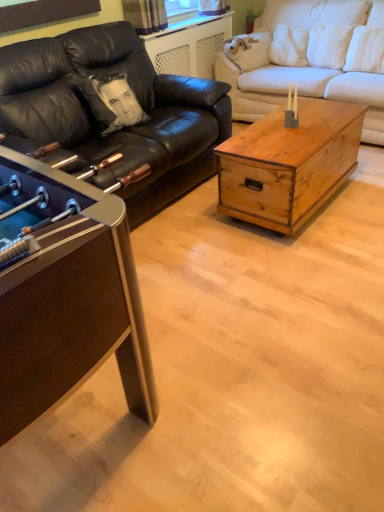
What do you see at coordinates (99, 122) in the screenshot?
I see `black leather couch at left, positioned as the first studio couch in left-to-right order` at bounding box center [99, 122].

What do you see at coordinates (311, 59) in the screenshot?
I see `white fabric couch at center, which is counted as the 1th studio couch, starting from the right` at bounding box center [311, 59].

In order to face white fabric couch at center, the 2th studio couch from the left, should I rotate leftwards or rightwards?

To align with it, rotate right about 16.221°.

Locate an element on the screen. The height and width of the screenshot is (512, 384). rustic wood trunk at center, positioned as the second coffee table in left-to-right order is located at coordinates (288, 164).

How much space does metallic brown foosball table at left, the second coffee table positioned from the right, occupy vertically?

metallic brown foosball table at left, the second coffee table positioned from the right, is 36.22 inches in height.

Where is `black leather couch at left, positioned as the first studio couch in left-to-right order`? black leather couch at left, positioned as the first studio couch in left-to-right order is located at coordinates (99, 122).

Can you confirm if white fabric couch at center, the 2th studio couch from the left, is thinner than black leather couch at left, arranged as the second studio couch when viewed from the right?

Yes.

Which is behind, point (287, 33) or point (42, 60)?

The point (287, 33) is behind.

Considering the sizes of objects white fabric couch at center, the 2th studio couch from the left, and black leather couch at left, arranged as the second studio couch when viewed from the right, in the image provided, who is shorter, white fabric couch at center, the 2th studio couch from the left, or black leather couch at left, arranged as the second studio couch when viewed from the right,?

black leather couch at left, arranged as the second studio couch when viewed from the right, is shorter.

Which is in front, white fabric couch at center, the 2th studio couch from the left, or black leather couch at left, arranged as the second studio couch when viewed from the right?

black leather couch at left, arranged as the second studio couch when viewed from the right.

From the image's perspective, does black leather couch at left, arranged as the second studio couch when viewed from the right, appear lower than white fabric couch at center, which is counted as the 1th studio couch, starting from the right?

Yes, from the image's perspective, black leather couch at left, arranged as the second studio couch when viewed from the right, is beneath white fabric couch at center, which is counted as the 1th studio couch, starting from the right.

Is black leather couch at left, positioned as the first studio couch in left-to-right order, in front of or behind white fabric couch at center, the 2th studio couch from the left, in the image?

In the image, black leather couch at left, positioned as the first studio couch in left-to-right order, appears in front of white fabric couch at center, the 2th studio couch from the left.

Is white fabric couch at center, the 2th studio couch from the left, a part of black leather couch at left, positioned as the first studio couch in left-to-right order?

No, white fabric couch at center, the 2th studio couch from the left, is located outside of black leather couch at left, positioned as the first studio couch in left-to-right order.

Which is closer, (x=87, y=102) or (x=376, y=106)?

Positioned in front is point (x=87, y=102).

Does point (23, 386) come in front of point (288, 61)?

Yes, it is in front of point (288, 61).

Which of these two, metallic brown foosball table at left, the second coffee table positioned from the right, or white fabric couch at center, the 2th studio couch from the left, is thinner?

With smaller width is metallic brown foosball table at left, the second coffee table positioned from the right.

Are metallic brown foosball table at left, the second coffee table positioned from the right, and white fabric couch at center, which is counted as the 1th studio couch, starting from the right, beside each other?

There is a gap between metallic brown foosball table at left, the second coffee table positioned from the right, and white fabric couch at center, which is counted as the 1th studio couch, starting from the right.

Is metallic brown foosball table at left, which is the first coffee table from left to right, completely or partially outside of white fabric couch at center, the 2th studio couch from the left?

Yes, metallic brown foosball table at left, which is the first coffee table from left to right, is not within white fabric couch at center, the 2th studio couch from the left.

Is white fabric couch at center, the 2th studio couch from the left, oriented towards white satin pillow at upper right?

Yes, white fabric couch at center, the 2th studio couch from the left, is turned towards white satin pillow at upper right.

Is point (323, 88) in front of point (344, 68)?

Yes, it is in front of point (344, 68).

Considering the sizes of objects white fabric couch at center, which is counted as the 1th studio couch, starting from the right, and white satin pillow at upper right in the image provided, who is thinner, white fabric couch at center, which is counted as the 1th studio couch, starting from the right, or white satin pillow at upper right?

white satin pillow at upper right is thinner.

In the scene shown: Between white fabric couch at center, which is counted as the 1th studio couch, starting from the right, and white satin pillow at upper right, which one has less height?

Standing shorter between the two is white satin pillow at upper right.

Considering the relative sizes of metallic brown foosball table at left, the second coffee table positioned from the right, and rustic wood trunk at center, which appears as the 1th coffee table when viewed from the right, in the image provided, is metallic brown foosball table at left, the second coffee table positioned from the right, thinner than rustic wood trunk at center, which appears as the 1th coffee table when viewed from the right,?

No, metallic brown foosball table at left, the second coffee table positioned from the right, is not thinner than rustic wood trunk at center, which appears as the 1th coffee table when viewed from the right.

This screenshot has width=384, height=512. I want to click on coffee table that is under the metallic brown foosball table at left, which is the first coffee table from left to right (from a real-world perspective), so click(288, 164).

Considering the positions of point (1, 151) and point (257, 152), is point (1, 151) closer or farther from the camera than point (257, 152)?

Point (1, 151) is closer to the camera than point (257, 152).

From the image's perspective, does metallic brown foosball table at left, the second coffee table positioned from the right, appear lower than black leather couch at left, positioned as the first studio couch in left-to-right order?

Yes, from the image's perspective, metallic brown foosball table at left, the second coffee table positioned from the right, is beneath black leather couch at left, positioned as the first studio couch in left-to-right order.

Which is in front, metallic brown foosball table at left, the second coffee table positioned from the right, or black leather couch at left, positioned as the first studio couch in left-to-right order?

metallic brown foosball table at left, the second coffee table positioned from the right, is closer to the camera.

Based on the photo, is metallic brown foosball table at left, the second coffee table positioned from the right, oriented towards black leather couch at left, arranged as the second studio couch when viewed from the right?

Yes.

Could you measure the distance between metallic brown foosball table at left, which is the first coffee table from left to right, and black leather couch at left, arranged as the second studio couch when viewed from the right?

3.99 feet.

What's the angular difference between white fabric couch at center, which is counted as the 1th studio couch, starting from the right, and metallic brown foosball table at left, the second coffee table positioned from the right,'s facing directions?

white fabric couch at center, which is counted as the 1th studio couch, starting from the right, and metallic brown foosball table at left, the second coffee table positioned from the right, are facing 177 degrees away from each other.

From the image's perspective, starting from the metallic brown foosball table at left, which is the first coffee table from left to right, which studio couch is the 2nd one above? Please provide its 2D coordinates.

[(311, 59)]

Is white fabric couch at center, which is counted as the 1th studio couch, starting from the right, bigger or smaller than metallic brown foosball table at left, the second coffee table positioned from the right?

In the image, white fabric couch at center, which is counted as the 1th studio couch, starting from the right, appears to be larger than metallic brown foosball table at left, the second coffee table positioned from the right.

From a real-world perspective, is white fabric couch at center, the 2th studio couch from the left, located beneath metallic brown foosball table at left, the second coffee table positioned from the right?

No.

The image size is (384, 512). Identify the location of studio couch that appears in front of the white fabric couch at center, which is counted as the 1th studio couch, starting from the right. (99, 122).

Locate an element on the screen. The height and width of the screenshot is (512, 384). studio couch below the white fabric couch at center, which is counted as the 1th studio couch, starting from the right (from the image's perspective) is located at coordinates (99, 122).

Considering their positions, is black leather couch at left, positioned as the first studio couch in left-to-right order, positioned further to metallic brown foosball table at left, which is the first coffee table from left to right, than rustic wood trunk at center, positioned as the second coffee table in left-to-right order?

The object further to metallic brown foosball table at left, which is the first coffee table from left to right, is rustic wood trunk at center, positioned as the second coffee table in left-to-right order.

From the image, which object appears to be nearer to metallic brown foosball table at left, which is the first coffee table from left to right, white fabric couch at center, which is counted as the 1th studio couch, starting from the right, or white satin pillow at upper right?

white fabric couch at center, which is counted as the 1th studio couch, starting from the right, lies closer to metallic brown foosball table at left, which is the first coffee table from left to right, than the other object.

When comparing their distances from rustic wood trunk at center, positioned as the second coffee table in left-to-right order, does white fabric couch at center, which is counted as the 1th studio couch, starting from the right, or metallic brown foosball table at left, which is the first coffee table from left to right, seem closer?

white fabric couch at center, which is counted as the 1th studio couch, starting from the right, lies closer to rustic wood trunk at center, positioned as the second coffee table in left-to-right order, than the other object.

Consider the image. Estimate the real-world distances between objects in this image. Which object is further from white fabric couch at center, which is counted as the 1th studio couch, starting from the right, black leather couch at left, positioned as the first studio couch in left-to-right order, or white satin pillow at upper right?

Based on the image, black leather couch at left, positioned as the first studio couch in left-to-right order, appears to be further to white fabric couch at center, which is counted as the 1th studio couch, starting from the right.

From the image, which object appears to be farther from rustic wood trunk at center, positioned as the second coffee table in left-to-right order, metallic brown foosball table at left, the second coffee table positioned from the right, or white fabric couch at center, the 2th studio couch from the left?

metallic brown foosball table at left, the second coffee table positioned from the right, is further to rustic wood trunk at center, positioned as the second coffee table in left-to-right order.

Estimate the real-world distances between objects in this image. Which object is closer to metallic brown foosball table at left, which is the first coffee table from left to right, rustic wood trunk at center, which appears as the 1th coffee table when viewed from the right, or white fabric couch at center, which is counted as the 1th studio couch, starting from the right?

The object closer to metallic brown foosball table at left, which is the first coffee table from left to right, is rustic wood trunk at center, which appears as the 1th coffee table when viewed from the right.

From the image, which object appears to be farther from rustic wood trunk at center, which appears as the 1th coffee table when viewed from the right, white satin pillow at upper right or white fabric couch at center, which is counted as the 1th studio couch, starting from the right?

Based on the image, white satin pillow at upper right appears to be further to rustic wood trunk at center, which appears as the 1th coffee table when viewed from the right.

Based on their spatial positions, is black leather couch at left, arranged as the second studio couch when viewed from the right, or rustic wood trunk at center, positioned as the second coffee table in left-to-right order, closer to white satin pillow at upper right?

Based on the image, rustic wood trunk at center, positioned as the second coffee table in left-to-right order, appears to be nearer to white satin pillow at upper right.

This screenshot has height=512, width=384. Find the location of `coffee table between black leather couch at left, positioned as the first studio couch in left-to-right order, and white satin pillow at upper right from left to right`. coffee table between black leather couch at left, positioned as the first studio couch in left-to-right order, and white satin pillow at upper right from left to right is located at coordinates (288, 164).

Identify the location of coffee table between black leather couch at left, positioned as the first studio couch in left-to-right order, and white fabric couch at center, the 2th studio couch from the left. Image resolution: width=384 pixels, height=512 pixels. (288, 164).

Find the location of a particular element. coffee table between metallic brown foosball table at left, which is the first coffee table from left to right, and white satin pillow at upper right in the front-back direction is located at coordinates click(288, 164).

In order to click on studio couch between black leather couch at left, positioned as the first studio couch in left-to-right order, and white satin pillow at upper right, in the horizontal direction in this screenshot , I will do `click(311, 59)`.